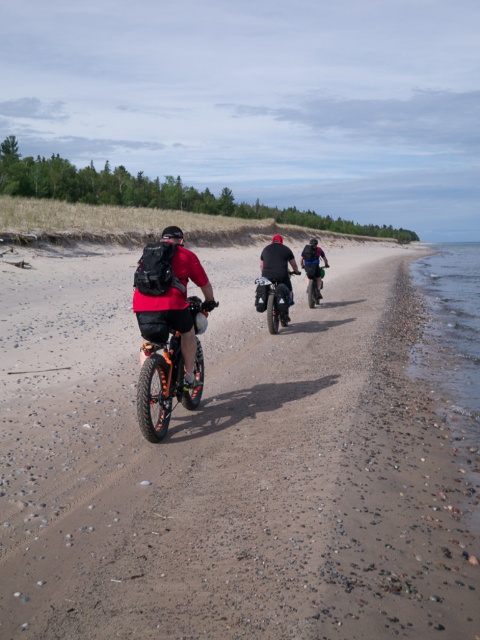
You are a cyclist riding a dirt bike and see the brown gravelly sand at center and the shiny black dirt bike at center ahead. Which object is closer to you?

The brown gravelly sand at center is closer to you because it is positioned in front of the shiny black dirt bike at center.

You are a photographer standing on the beach and want to capture both the orange matte bicycle at center and the green matte dirt bike at center in a single photo. Considering their heights, which bicycle will appear larger in the photo?

The orange matte bicycle at center is much taller than the green matte dirt bike at center, so it will appear larger in the photo.